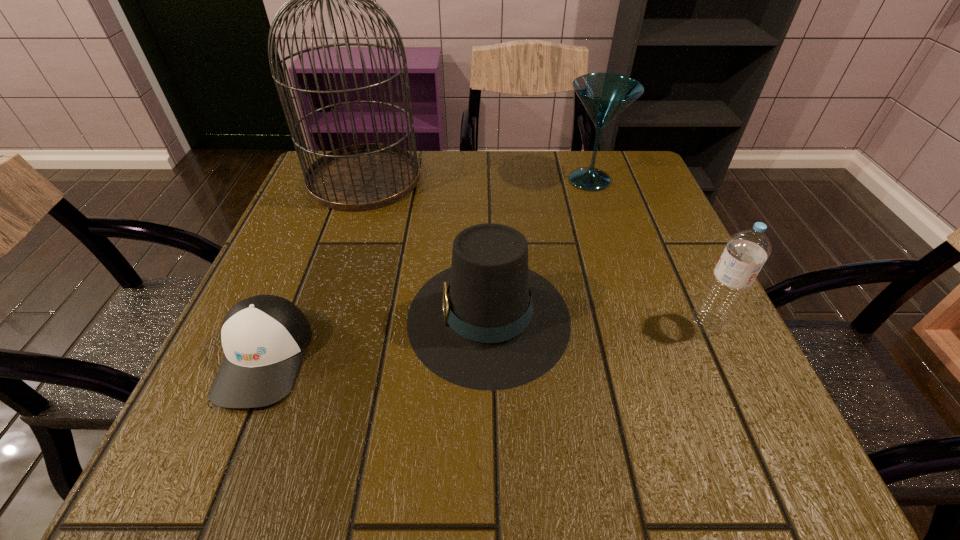
Where is `vacant area that lies between the birdcage and the second shortest object`? Image resolution: width=960 pixels, height=540 pixels. vacant area that lies between the birdcage and the second shortest object is located at coordinates 426,247.

Identify the location of free space between the martini and the rightmost object. This screenshot has height=540, width=960. (649, 251).

The image size is (960, 540). I want to click on empty space that is in between the second shortest object and the martini, so click(x=540, y=248).

Locate an element on the screen. Image resolution: width=960 pixels, height=540 pixels. free space between the third object from left to right and the rightmost object is located at coordinates (598, 320).

You are a GUI agent. You are given a task and a screenshot of the screen. Output one action in this format:
    pyautogui.click(x=<x>, y=<y>)
    Task: Click on the free point between the second shortest object and the second object from right to left
    Image resolution: width=960 pixels, height=540 pixels.
    Given the screenshot: What is the action you would take?
    pyautogui.click(x=540, y=248)

Point out which object is positioned as the fourth nearest to the third object from left to right. Please provide its 2D coordinates. Your answer should be formatted as a tuple, i.e. [(x, y)], where the tuple contains the x and y coordinates of a point satisfying the conditions above.

[(604, 95)]

Identify the location of the fourth closest object to the hat. (604, 95).

Find the location of `free space that satisfies the following two spatial constraints: 1. on the front-facing side of the second shortest object; 2. on the front panel of the shortest object`. free space that satisfies the following two spatial constraints: 1. on the front-facing side of the second shortest object; 2. on the front panel of the shortest object is located at coordinates (490, 357).

The height and width of the screenshot is (540, 960). Find the location of `free space that satisfies the following two spatial constraints: 1. on the front-facing side of the hat; 2. on the front panel of the shortest object`. free space that satisfies the following two spatial constraints: 1. on the front-facing side of the hat; 2. on the front panel of the shortest object is located at coordinates (490, 357).

Locate an element on the screen. Image resolution: width=960 pixels, height=540 pixels. vacant space that satisfies the following two spatial constraints: 1. on the front side of the birdcage; 2. on the left side of the fourth object from left to right is located at coordinates (364, 180).